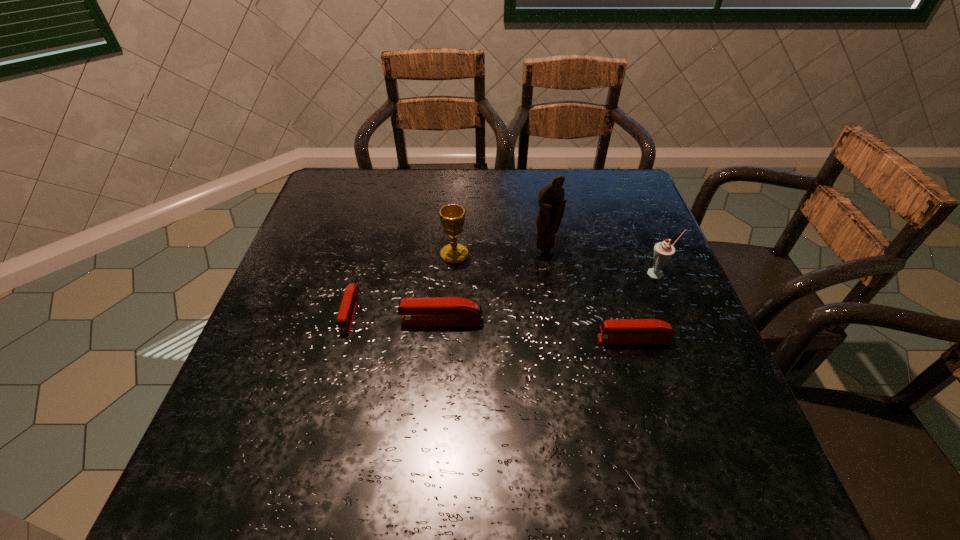
Where is `free space between the chalice and the third farthest object`? This screenshot has width=960, height=540. free space between the chalice and the third farthest object is located at coordinates (557, 264).

Where is `vacant point located between the figurine and the fourth nearest object`? vacant point located between the figurine and the fourth nearest object is located at coordinates (602, 262).

This screenshot has height=540, width=960. Find the location of `free space between the third object from right to left and the rightmost object`. free space between the third object from right to left and the rightmost object is located at coordinates (602, 262).

This screenshot has width=960, height=540. I want to click on empty space between the milkshake and the chalice, so click(557, 264).

Find the location of a particular element. Image resolution: width=960 pixels, height=540 pixels. vacant space that is in between the second stapler from right to left and the shortest stapler is located at coordinates (396, 316).

At what (x,y) coordinates should I click in order to perform the action: click on vacant space that is in between the fifth tallest object and the second stapler from left to right. Please return your answer as a coordinate pair (x, y). This screenshot has height=540, width=960. Looking at the image, I should click on (538, 330).

The image size is (960, 540). I want to click on free spot between the rightmost object and the nearest stapler, so click(646, 307).

This screenshot has height=540, width=960. I want to click on free space that is in between the tallest object and the milkshake, so click(x=602, y=262).

Where is `vacant point located between the nearest object and the second stapler from left to right`? This screenshot has height=540, width=960. vacant point located between the nearest object and the second stapler from left to right is located at coordinates (538, 330).

Select which object appears as the fourth closest to the fourth nearest object. Please provide its 2D coordinates. Your answer should be formatted as a tuple, i.e. [(x, y)], where the tuple contains the x and y coordinates of a point satisfying the conditions above.

[(452, 216)]